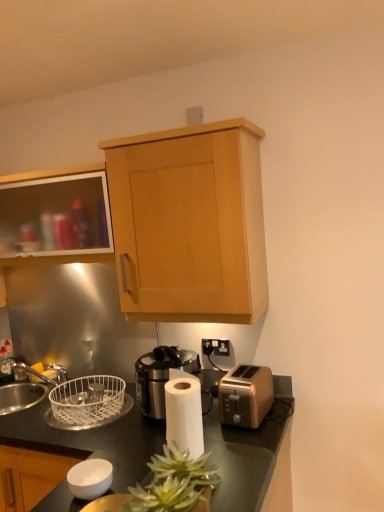
Question: Can you confirm if black metallic coffee machine at center is positioned to the right of black plastic electrical outlet at center?

Choices:
 (A) yes
 (B) no

Answer: (B)

Question: From the image's perspective, would you say black metallic coffee machine at center is shown under black plastic electrical outlet at center?

Choices:
 (A) no
 (B) yes

Answer: (B)

Question: Is black metallic coffee machine at center shorter than black plastic electrical outlet at center?

Choices:
 (A) yes
 (B) no

Answer: (B)

Question: Is black metallic coffee machine at center wider than black plastic electrical outlet at center?

Choices:
 (A) no
 (B) yes

Answer: (B)

Question: Is black metallic coffee machine at center in contact with black plastic electrical outlet at center?

Choices:
 (A) no
 (B) yes

Answer: (A)

Question: From a real-world perspective, is black metallic coffee machine at center below black plastic electrical outlet at center?

Choices:
 (A) yes
 (B) no

Answer: (A)

Question: From a real-world perspective, is black glossy countertop at center on green leafy plant at center?

Choices:
 (A) no
 (B) yes

Answer: (A)

Question: Is black glossy countertop at center in contact with green leafy plant at center?

Choices:
 (A) yes
 (B) no

Answer: (B)

Question: Does black glossy countertop at center lie behind green leafy plant at center?

Choices:
 (A) no
 (B) yes

Answer: (B)

Question: Is black glossy countertop at center not within green leafy plant at center?

Choices:
 (A) yes
 (B) no

Answer: (A)

Question: Could green leafy plant at center be considered to be inside black glossy countertop at center?

Choices:
 (A) yes
 (B) no

Answer: (B)

Question: From the image's perspective, is black glossy countertop at center over green leafy plant at center?

Choices:
 (A) no
 (B) yes

Answer: (A)

Question: Does matte glass cabinet at upper left, which ranks as the 2th cabinetry in right-to-left order, come behind light wood cabinet at upper center, marked as the 2th cabinetry in a left-to-right arrangement?

Choices:
 (A) no
 (B) yes

Answer: (B)